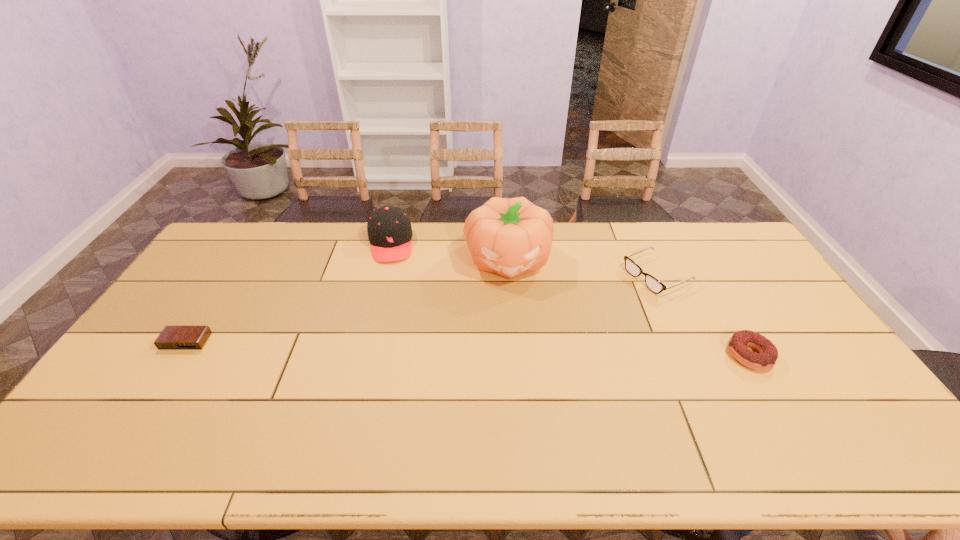
Locate an element on the screen. spectacles located in the far edge section of the desktop is located at coordinates (653, 284).

Where is `cap present at the far edge`? Image resolution: width=960 pixels, height=540 pixels. cap present at the far edge is located at coordinates [x=389, y=229].

Find the location of a particular element. This screenshot has height=540, width=960. object present at the left edge is located at coordinates (172, 337).

Locate an element on the screen. object present at the right edge is located at coordinates (737, 345).

The width and height of the screenshot is (960, 540). Find the location of `free region at the far edge`. free region at the far edge is located at coordinates (277, 235).

Locate an element on the screen. Image resolution: width=960 pixels, height=540 pixels. vacant region at the near edge of the desktop is located at coordinates (250, 420).

Locate an element on the screen. The width and height of the screenshot is (960, 540). free location at the left edge of the desktop is located at coordinates (225, 286).

I want to click on blank area at the right edge, so click(x=784, y=357).

At what (x,y) coordinates should I click in order to perform the action: click on free spot at the far left corner of the desktop. Please return your answer as a coordinate pair (x, y). Image resolution: width=960 pixels, height=540 pixels. Looking at the image, I should click on (253, 223).

In the image, there is a desktop. Where is `free space at the far right corner`? This screenshot has width=960, height=540. free space at the far right corner is located at coordinates (715, 241).